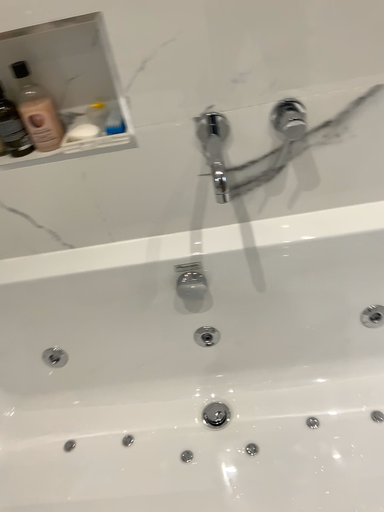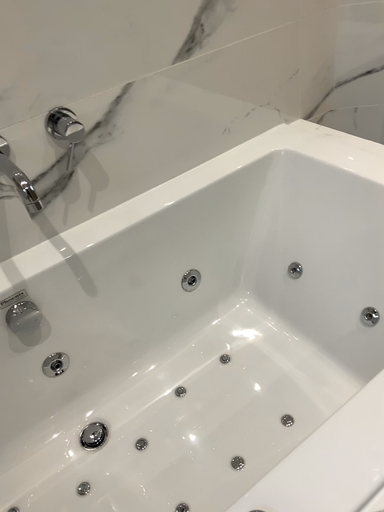
Question: How did the camera likely rotate when shooting the video?

Choices:
 (A) rotated right
 (B) rotated left

Answer: (A)